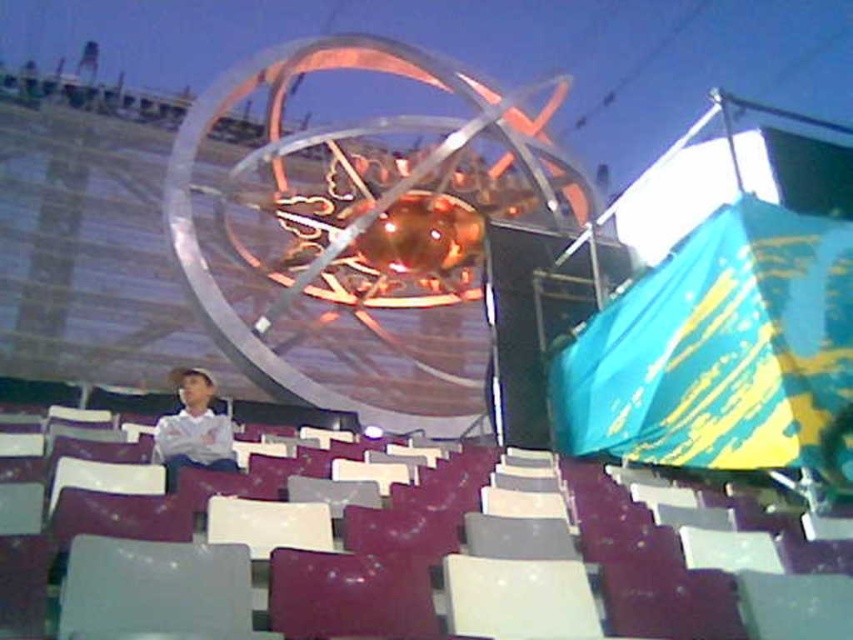
Question: Can you confirm if white plastic chair at center is positioned to the left of white matte shirt at center?

Choices:
 (A) yes
 (B) no

Answer: (B)

Question: Is white plastic chair at center behind white matte shirt at center?

Choices:
 (A) no
 (B) yes

Answer: (A)

Question: Which point is closer to the camera?

Choices:
 (A) (206, 454)
 (B) (463, 611)

Answer: (B)

Question: Does white plastic chair at center have a larger size compared to white matte shirt at center?

Choices:
 (A) yes
 (B) no

Answer: (B)